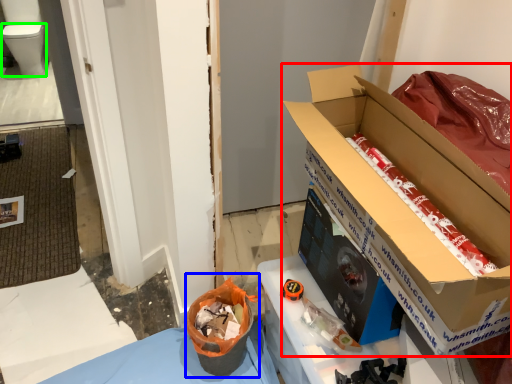
Question: Which object is positioned closest to box (highlighted by a red box)? Select from recycling bin (highlighted by a blue box) and toilet bowl (highlighted by a green box).

Choices:
 (A) recycling bin
 (B) toilet bowl

Answer: (A)